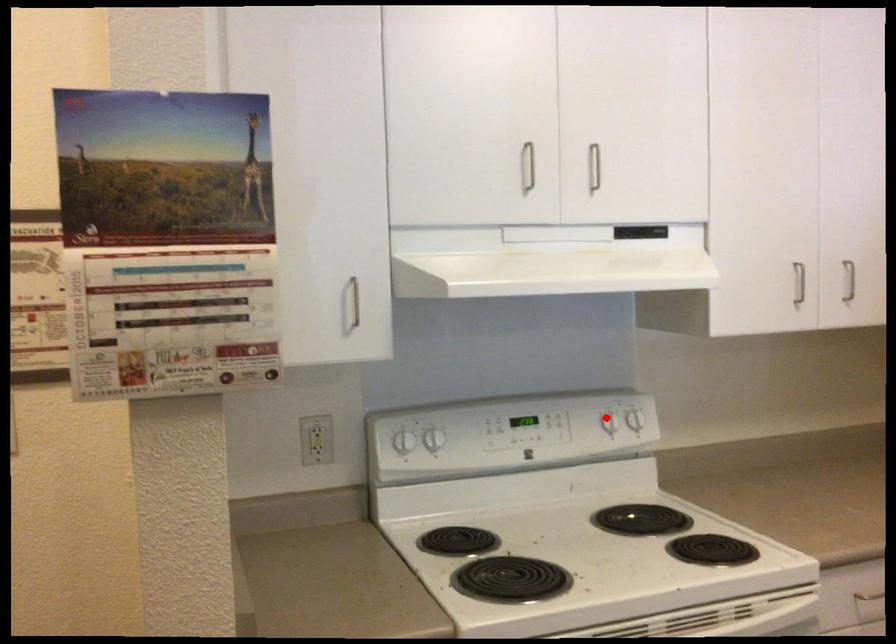
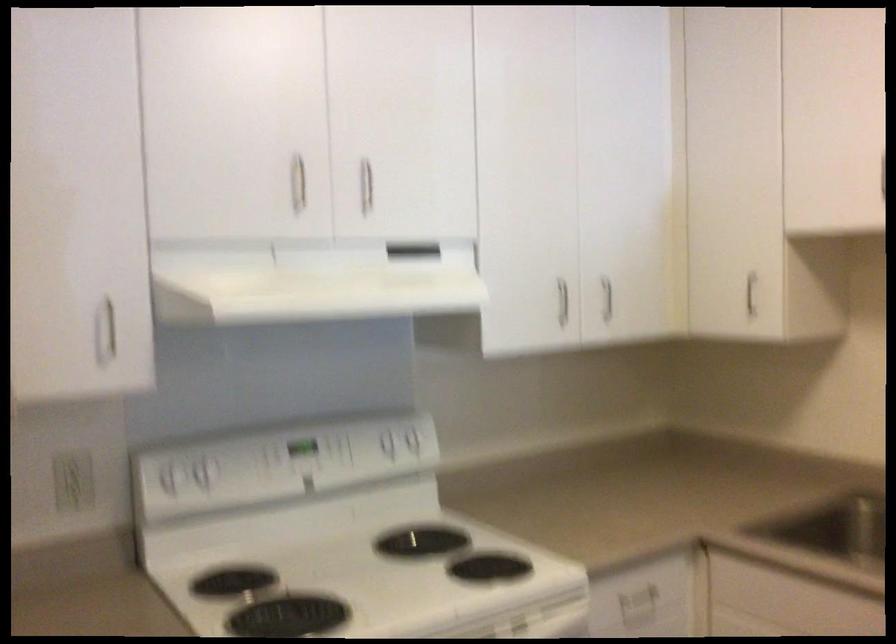
In the second image, find the point that corresponds to the highlighted location in the first image.

(385, 440)